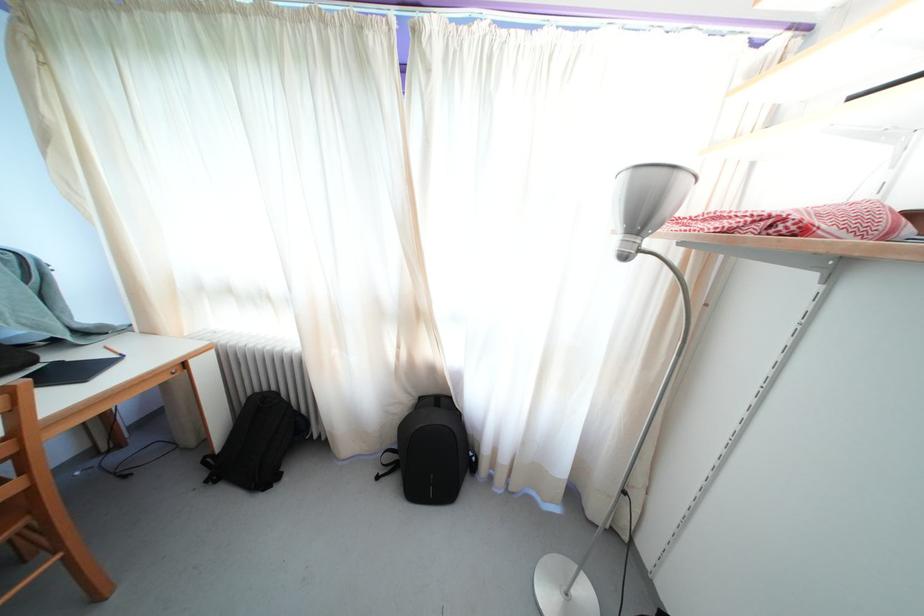
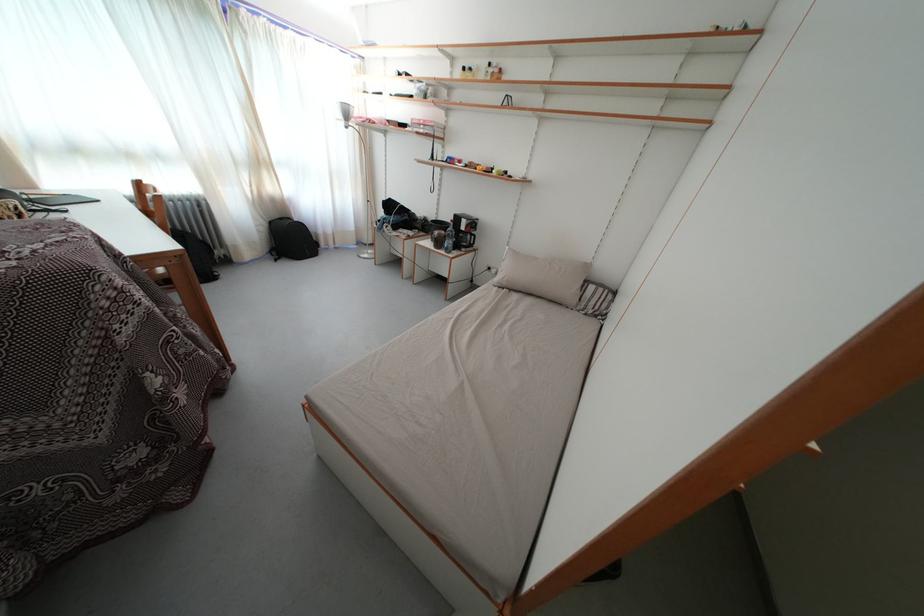
Where in the second image is the point corresponding to [410,408] from the first image?

(272, 230)